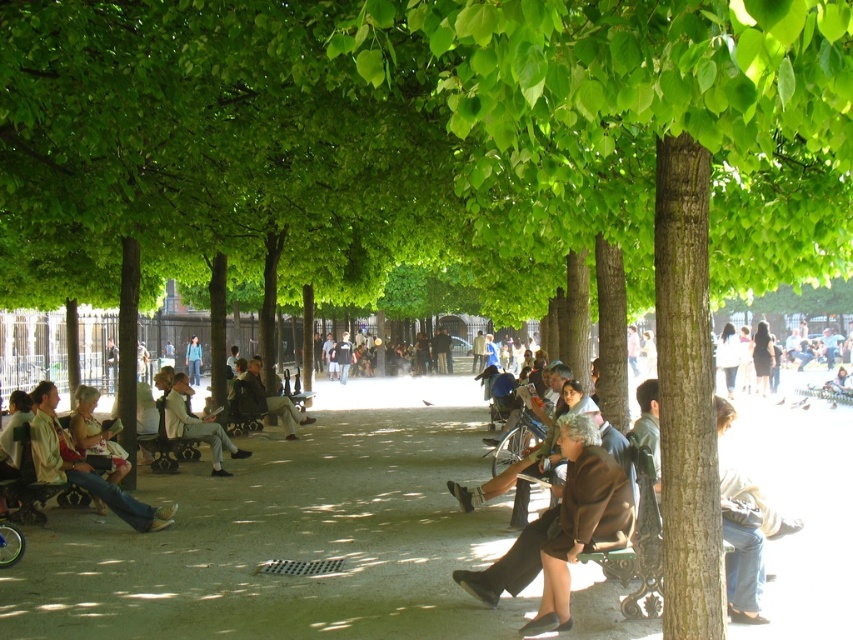
Between point (45, 467) and point (258, 400), which one is positioned in front?

Point (45, 467)

Is denim jeans at left positioned behind light brown leather jacket at center?

No, it is not.

Describe the element at coordinates (82, 467) in the screenshot. I see `denim jeans at left` at that location.

This screenshot has height=640, width=853. I want to click on denim jeans at left, so click(82, 467).

Does light brown leather jacket at center come behind blue jeans at center?

No, it is in front of blue jeans at center.

Can you confirm if light brown leather jacket at center is bigger than blue jeans at center?

Incorrect, light brown leather jacket at center is not larger than blue jeans at center.

What do you see at coordinates (268, 400) in the screenshot? This screenshot has height=640, width=853. I see `light brown leather jacket at center` at bounding box center [268, 400].

This screenshot has width=853, height=640. Find the location of `light brown leather jacket at center`. light brown leather jacket at center is located at coordinates (268, 400).

Does brown fabric coat at center appear on the left side of light brown leather jacket at lower left?

No, brown fabric coat at center is not to the left of light brown leather jacket at lower left.

Is brown fabric coat at center further to camera compared to light brown leather jacket at lower left?

That is False.

Identify the location of brown fabric coat at center. This screenshot has width=853, height=640. (563, 529).